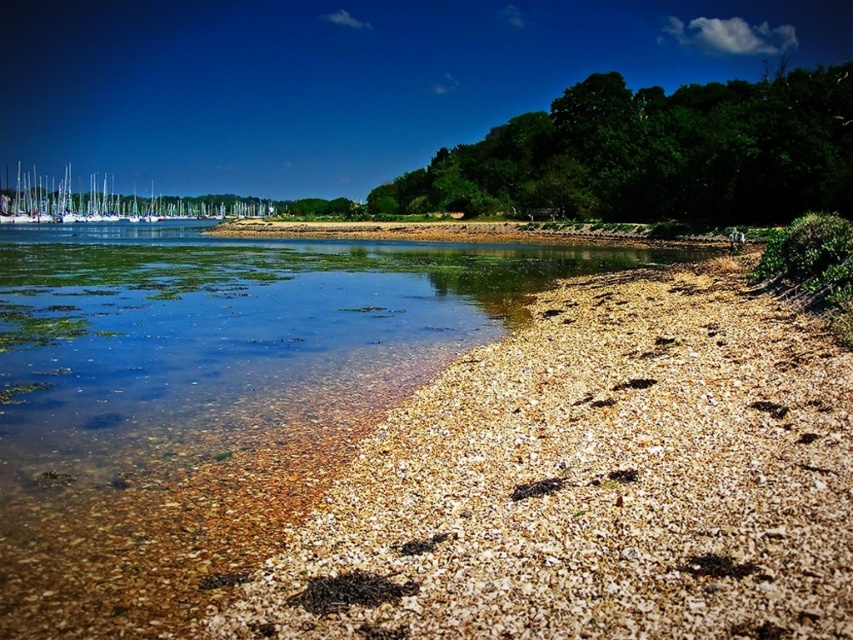
You are standing on the beach and want to walk from the brown gravelly sand at lower left to the white glossy boats at upper left. Based on the scene description, which path would require taking fewer steps if you choose the narrower path?

The path over the brown gravelly sand at lower left requires fewer steps because its width is narrower than the white glossy boats at upper left.

Looking at this image, you are standing at the edge of the water and see the brown gravelly sand at lower left and the green leafy trees at upper right. Which object is positioned to the left of the other?

The brown gravelly sand at lower left is to the left of the green leafy trees at upper right.